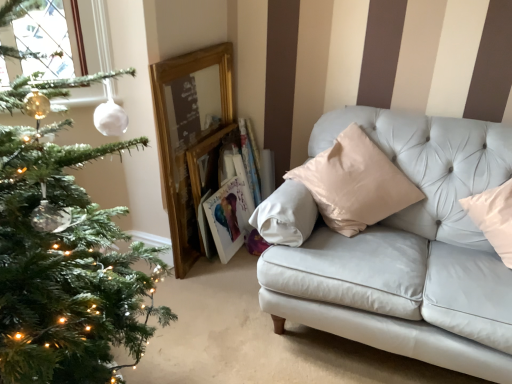
At what (x,y) coordinates should I click in order to perform the action: click on free space in front of wooden picture frame at center. Please return your answer as a coordinate pair (x, y). Image resolution: width=512 pixels, height=384 pixels. Looking at the image, I should click on (220, 268).